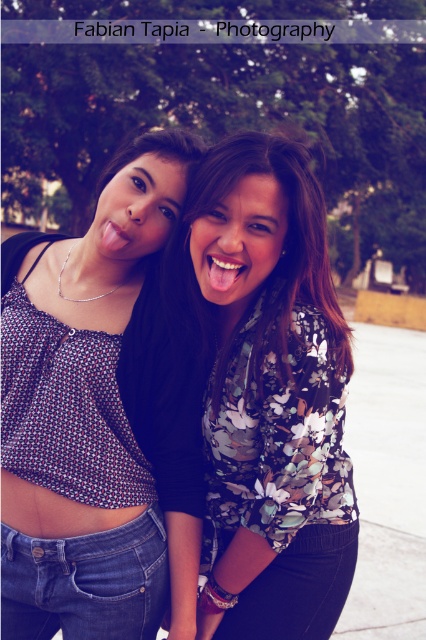
Between floral-patterned shirt at center and printed fabric blouse at center, which one is positioned higher?

printed fabric blouse at center is higher up.

Is floral-patterned shirt at center closer to the viewer compared to printed fabric blouse at center?

Yes, it is.

The width and height of the screenshot is (426, 640). I want to click on floral-patterned shirt at center, so click(267, 392).

What are the coordinates of `floral-patterned shirt at center` in the screenshot? It's located at (267, 392).